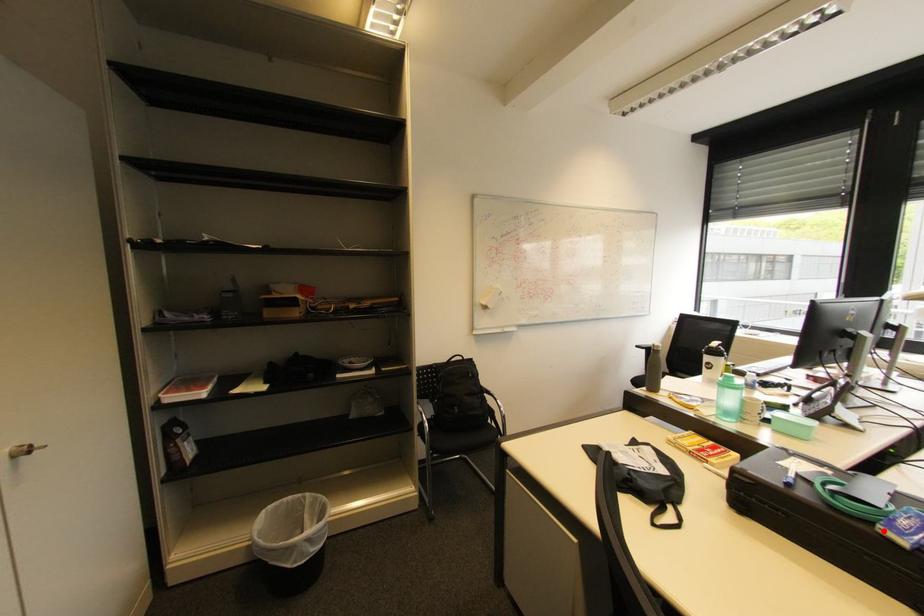
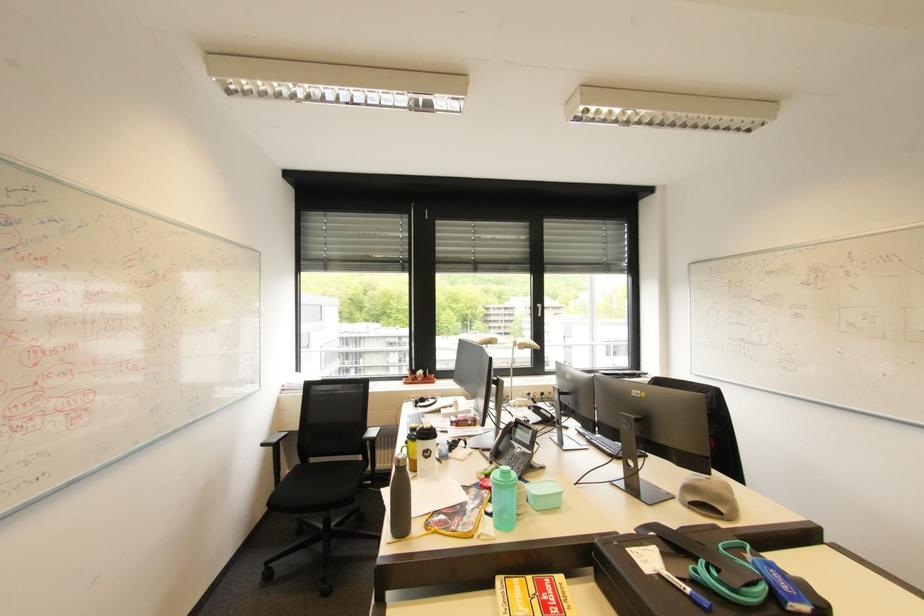
Locate, in the second image, the point that corresponds to the highlighted location in the first image.

(795, 610)